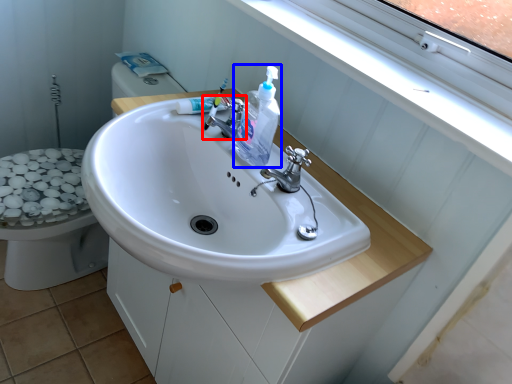
Question: Which of the following is the closest to the observer, tap (highlighted by a red box) or cleaning product (highlighted by a blue box)?

Choices:
 (A) tap
 (B) cleaning product

Answer: (B)